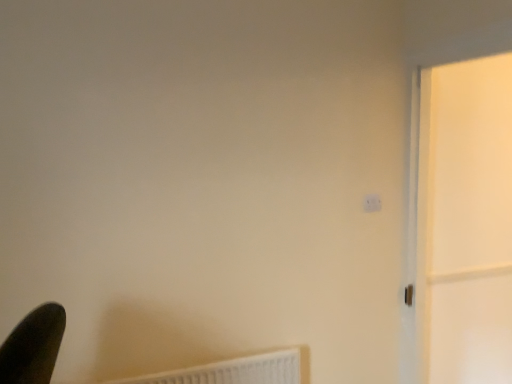
Question: Is the position of white glossy screen door at right less distant than that of white plastic radiator at lower left?

Choices:
 (A) no
 (B) yes

Answer: (B)

Question: From the image's perspective, does white glossy screen door at right appear lower than white plastic radiator at lower left?

Choices:
 (A) yes
 (B) no

Answer: (B)

Question: Is white glossy screen door at right turned away from white plastic radiator at lower left?

Choices:
 (A) yes
 (B) no

Answer: (B)

Question: Is white glossy screen door at right taller than white plastic radiator at lower left?

Choices:
 (A) yes
 (B) no

Answer: (A)

Question: Does white glossy screen door at right appear on the left side of white plastic radiator at lower left?

Choices:
 (A) yes
 (B) no

Answer: (B)

Question: Does white glossy screen door at right appear on the right side of white plastic radiator at lower left?

Choices:
 (A) no
 (B) yes

Answer: (B)

Question: From the image's perspective, is white plastic light switch at upper right on white plastic radiator at lower left?

Choices:
 (A) yes
 (B) no

Answer: (A)

Question: Can you confirm if white plastic light switch at upper right is shorter than white plastic radiator at lower left?

Choices:
 (A) yes
 (B) no

Answer: (A)

Question: Is white plastic light switch at upper right facing away from white plastic radiator at lower left?

Choices:
 (A) yes
 (B) no

Answer: (B)

Question: From the image's perspective, does white plastic light switch at upper right appear lower than white plastic radiator at lower left?

Choices:
 (A) yes
 (B) no

Answer: (B)

Question: Does white plastic light switch at upper right appear on the left side of white plastic radiator at lower left?

Choices:
 (A) no
 (B) yes

Answer: (A)

Question: Is white plastic light switch at upper right in contact with white plastic radiator at lower left?

Choices:
 (A) no
 (B) yes

Answer: (A)

Question: Is white plastic radiator at lower left oriented towards white plastic light switch at upper right?

Choices:
 (A) no
 (B) yes

Answer: (A)